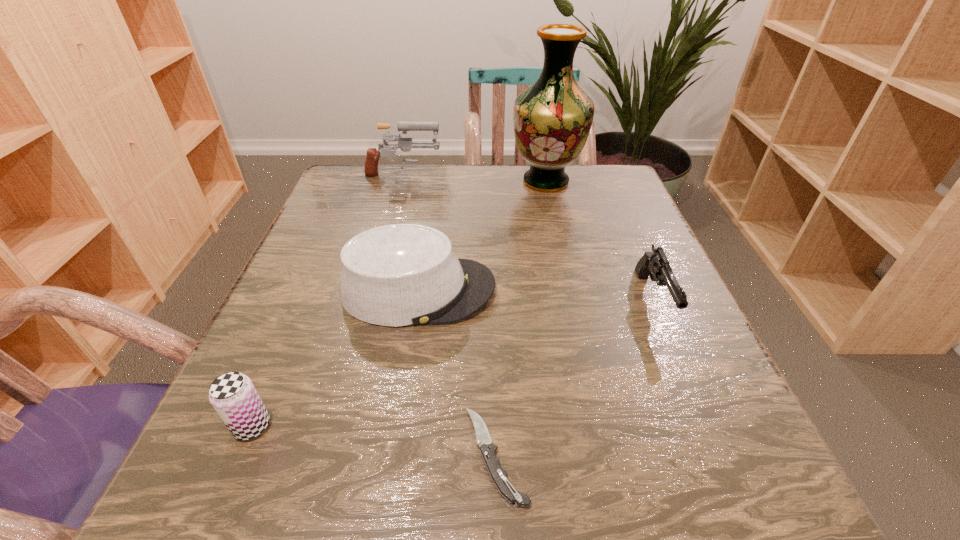
Where is `beer can at the left edge`? Image resolution: width=960 pixels, height=540 pixels. beer can at the left edge is located at coordinates (233, 395).

At what (x,y) coordinates should I click in order to perform the action: click on vase at the right edge. Please return your answer as a coordinate pair (x, y). Looking at the image, I should click on (552, 118).

I want to click on gun situated at the right edge, so click(655, 264).

Where is `object present at the far left corner`? object present at the far left corner is located at coordinates (405, 144).

I want to click on object at the far right corner, so click(552, 118).

Find the location of a particular element. vacant area at the far edge of the desktop is located at coordinates (444, 173).

Find the location of a particular element. The height and width of the screenshot is (540, 960). vacant space at the near edge of the desktop is located at coordinates (446, 484).

This screenshot has height=540, width=960. In order to click on blank area at the left edge in this screenshot , I will do `click(299, 376)`.

Identify the location of vacant space at the right edge of the desktop. The height and width of the screenshot is (540, 960). (707, 340).

The image size is (960, 540). In the image, there is a desktop. What are the coordinates of `blank space at the far left corner` in the screenshot? It's located at (382, 188).